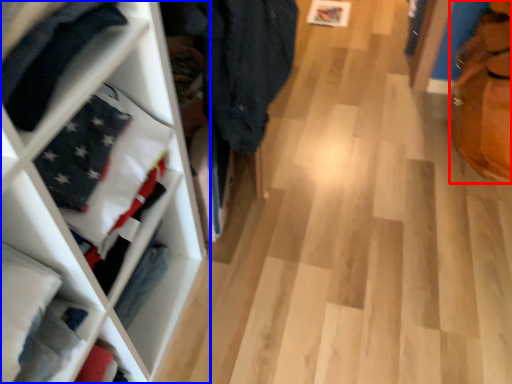
Question: Which of the following is the closest to the observer, tote bag (highlighted by a red box) or shelf (highlighted by a blue box)?

Choices:
 (A) tote bag
 (B) shelf

Answer: (B)